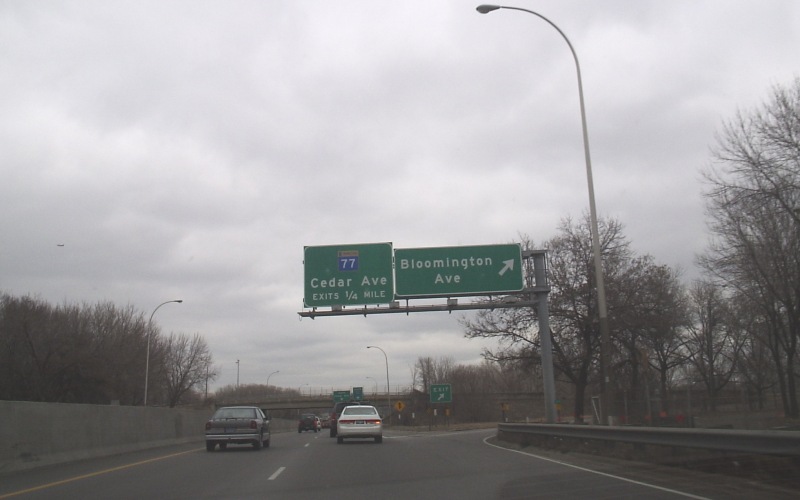
Locate an element on the screen. This screenshot has height=500, width=800. light gray concrete divider is located at coordinates (100, 428).